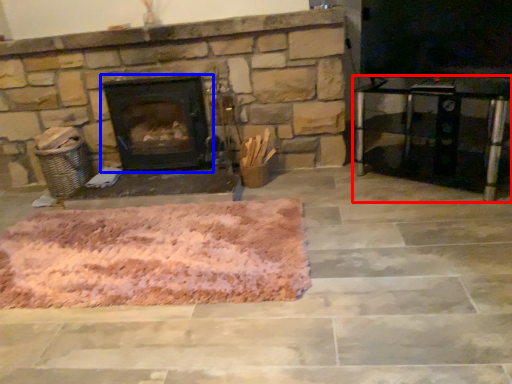
Question: Which object appears closest to the camera in this image, entertainment center (highlighted by a red box) or wood burning stove (highlighted by a blue box)?

Choices:
 (A) entertainment center
 (B) wood burning stove

Answer: (A)